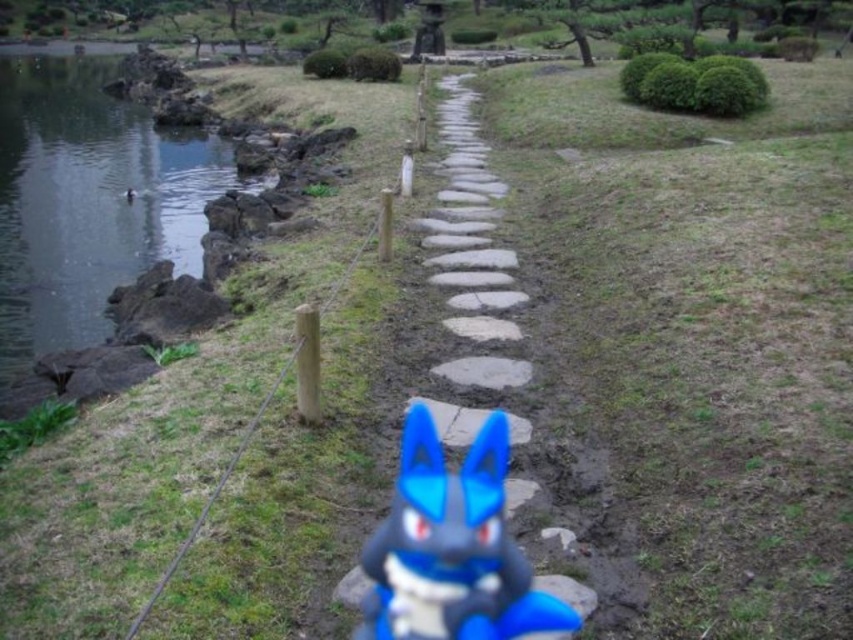
Which is below, smooth stone path at center or blue plastic toy at center?

blue plastic toy at center is lower down.

Is point (462, 256) positioned after point (508, 564)?

Yes, point (462, 256) is behind point (508, 564).

Is point (407, 582) positioned after point (500, 529)?

That is False.

This screenshot has height=640, width=853. Identify the location of smooth stone path at center. (453, 541).

Which is more to the right, smooth stone lake at left or blue plastic toy at center?

blue plastic toy at center is more to the right.

Can you confirm if smooth stone lake at left is positioned to the right of blue plastic toy at center?

Incorrect, smooth stone lake at left is not on the right side of blue plastic toy at center.

Between point (167, 237) and point (445, 588), which one is positioned behind?

Positioned behind is point (167, 237).

Identify the location of smooth stone lake at left. The width and height of the screenshot is (853, 640). (88, 202).

Does smooth stone lake at left appear over smooth stone path at center?

Yes, smooth stone lake at left is above smooth stone path at center.

Measure the distance between point (148,225) and camera.

A distance of 45.94 feet exists between point (148,225) and camera.

Image resolution: width=853 pixels, height=640 pixels. Identify the location of smooth stone lake at left. 88,202.